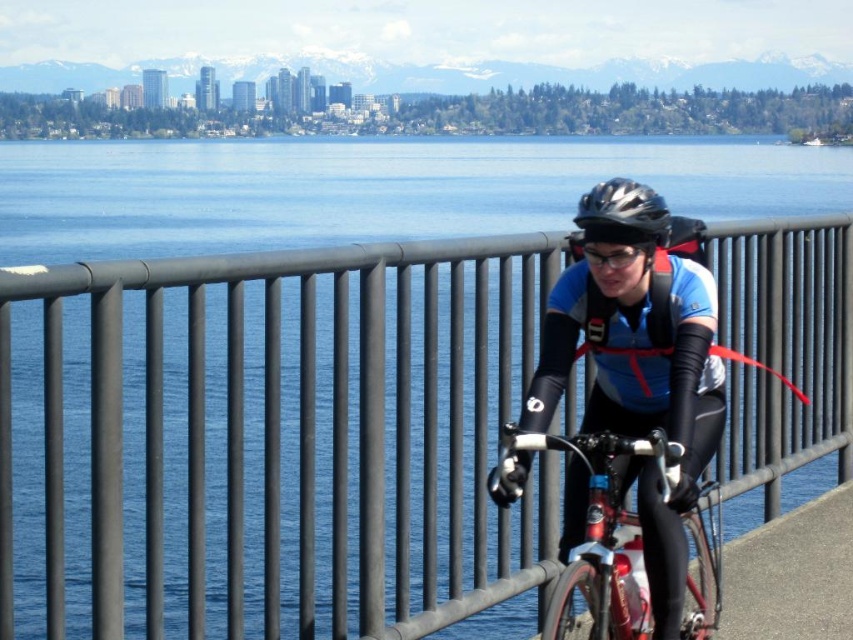
Who is shorter, black metal fence at center or matte blue jersey at center?

matte blue jersey at center is shorter.

Can you confirm if black metal fence at center is taller than matte blue jersey at center?

Yes, black metal fence at center is taller than matte blue jersey at center.

The width and height of the screenshot is (853, 640). I want to click on black metal fence at center, so click(270, 442).

Measure the distance between point (238,397) and camera.

7.08 meters

Based on the photo, does black metal fence at center have a lesser height compared to transparent plastic goggles at center?

Incorrect, black metal fence at center's height does not fall short of transparent plastic goggles at center's.

Measure the distance between point (532, 275) and camera.

The distance of point (532, 275) from camera is 9.42 meters.

The height and width of the screenshot is (640, 853). Find the location of `black metal fence at center`. black metal fence at center is located at coordinates (270, 442).

Can you confirm if matte blue jersey at center is positioned to the right of shiny metallic bicycle at center?

In fact, matte blue jersey at center is to the left of shiny metallic bicycle at center.

Is point (641, 340) behind point (612, 563)?

Yes.

Identify the location of matte blue jersey at center. (640, 365).